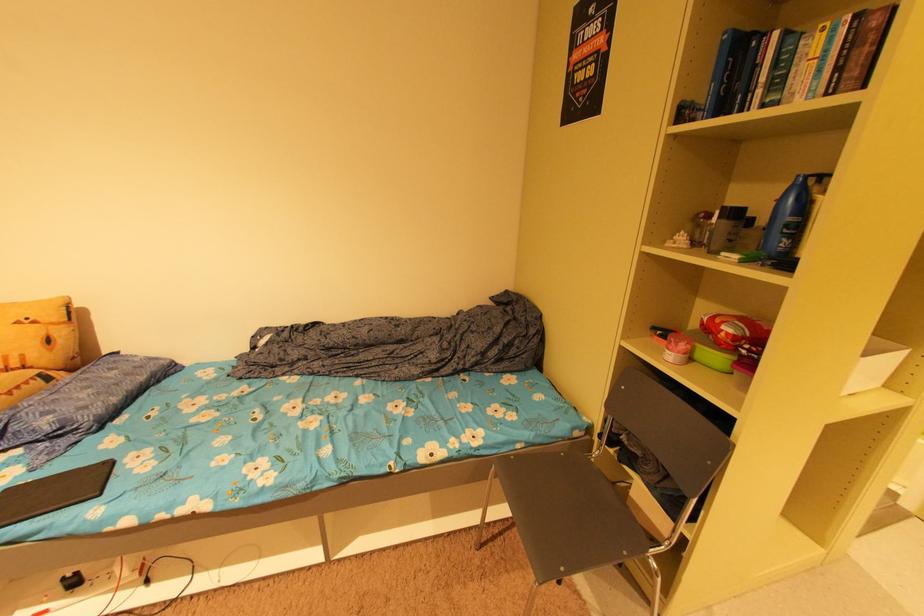
Image resolution: width=924 pixels, height=616 pixels. I want to click on blue book, so click(x=723, y=71).